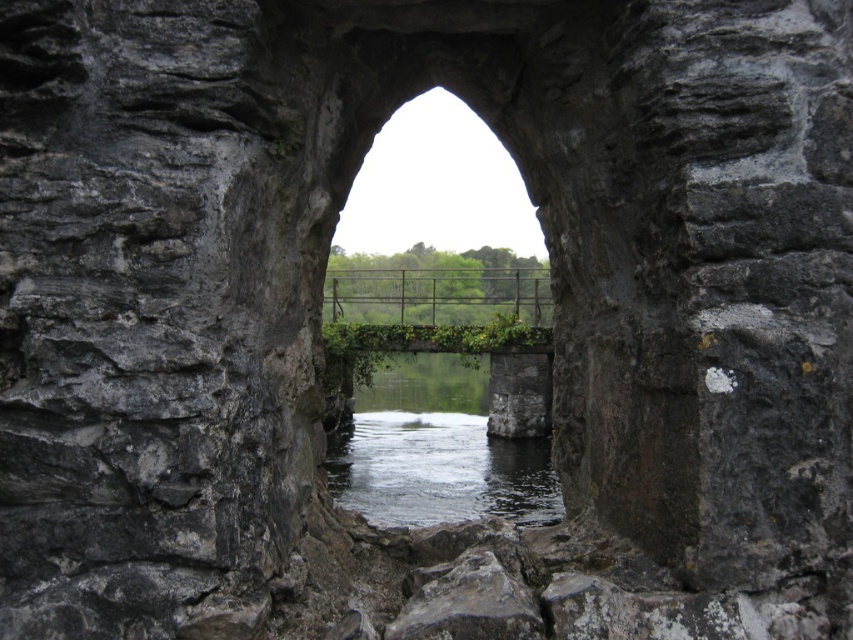
Question: Which point is farther from the camera taking this photo?

Choices:
 (A) (465, 284)
 (B) (514, 508)

Answer: (A)

Question: Can you confirm if clear water at center is positioned to the left of metallic wire bridge at center?

Choices:
 (A) yes
 (B) no

Answer: (B)

Question: Does clear water at center appear on the right side of metallic wire bridge at center?

Choices:
 (A) yes
 (B) no

Answer: (A)

Question: Which point is farther to the camera?

Choices:
 (A) (492, 310)
 (B) (454, 388)

Answer: (B)

Question: Is clear water at center wider than metallic wire bridge at center?

Choices:
 (A) no
 (B) yes

Answer: (A)